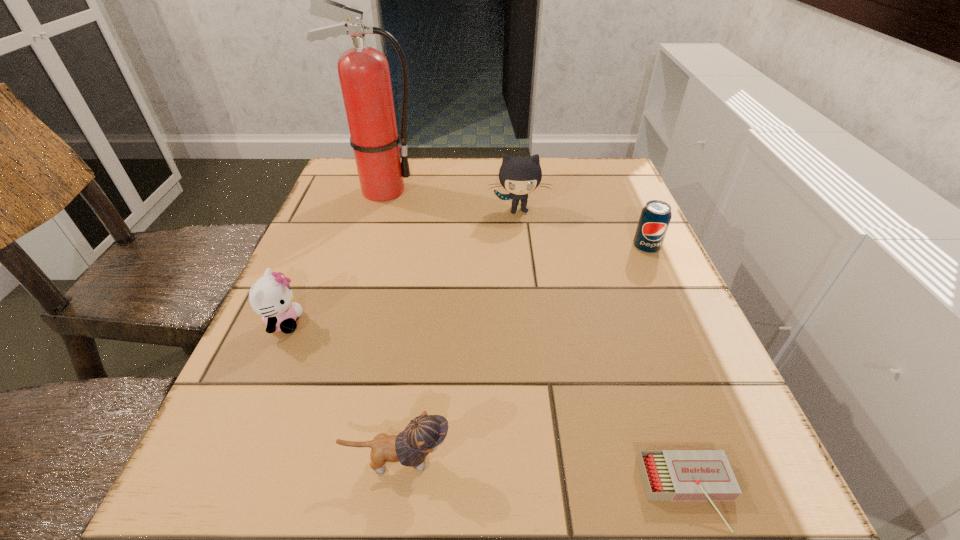
The height and width of the screenshot is (540, 960). What are the coordinates of `vacant region located on the hose direction of the tallest object` in the screenshot? It's located at (456, 191).

The width and height of the screenshot is (960, 540). Identify the location of blank space located 0.150m on the front-facing side of the fourth object from left to right. (524, 260).

The height and width of the screenshot is (540, 960). I want to click on free spot located 0.310m on the front-facing side of the leftmost kitten, so click(475, 322).

At what (x,y) coordinates should I click in order to perform the action: click on free space located on the left of the soda can. Please return your answer as a coordinate pair (x, y). Image resolution: width=960 pixels, height=540 pixels. Looking at the image, I should click on (540, 248).

The height and width of the screenshot is (540, 960). Identify the location of vacant area situated on the front-facing side of the second kitten from left to right. (745, 462).

The image size is (960, 540). Find the location of `fire extinguisher that is at the far edge`. fire extinguisher that is at the far edge is located at coordinates pos(364,75).

This screenshot has height=540, width=960. I want to click on kitten located at the far edge, so click(x=518, y=175).

The width and height of the screenshot is (960, 540). I want to click on kitten situated at the near edge, so click(x=424, y=433).

This screenshot has width=960, height=540. Identify the location of matchbox at the near edge. (667, 475).

Where is `fire extinguisher that is at the left edge`? The width and height of the screenshot is (960, 540). fire extinguisher that is at the left edge is located at coordinates (364, 75).